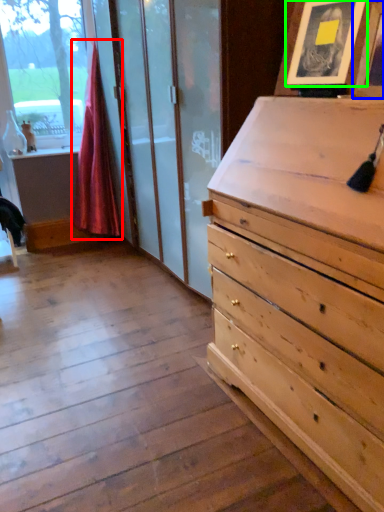
Question: Which object is the closest to the curtain (highlighted by a red box)? Choose among these: picture frame (highlighted by a blue box) or picture frame (highlighted by a green box).

Choices:
 (A) picture frame
 (B) picture frame

Answer: (B)